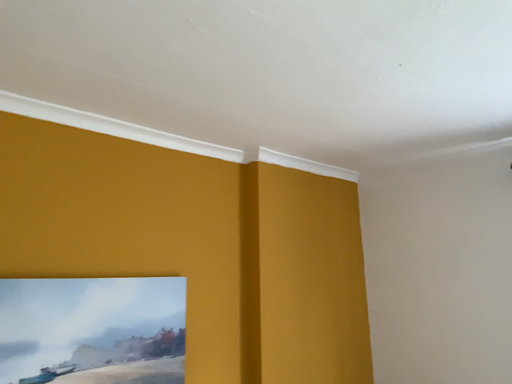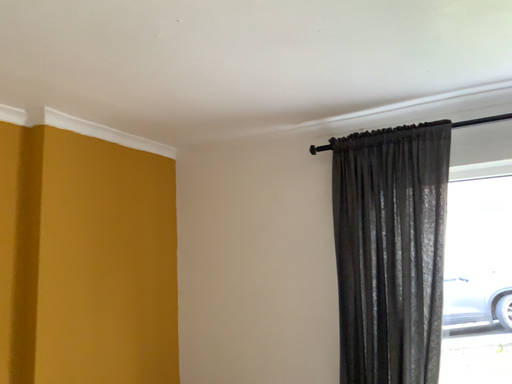
Question: Which way did the camera rotate in the video?

Choices:
 (A) rotated left
 (B) rotated right

Answer: (B)